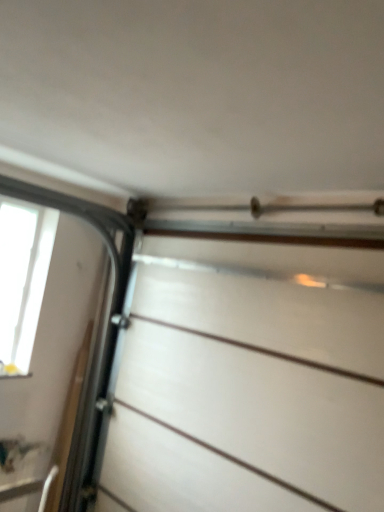
Question: Is white matte drawer at center outside transparent glass window at left?

Choices:
 (A) no
 (B) yes

Answer: (B)

Question: Does white matte drawer at center have a greater height compared to transparent glass window at left?

Choices:
 (A) yes
 (B) no

Answer: (A)

Question: Is white matte drawer at center placed right next to transparent glass window at left?

Choices:
 (A) yes
 (B) no

Answer: (B)

Question: Is white matte drawer at center positioned in front of transparent glass window at left?

Choices:
 (A) no
 (B) yes

Answer: (B)

Question: Does white matte drawer at center have a lesser width compared to transparent glass window at left?

Choices:
 (A) yes
 (B) no

Answer: (B)

Question: From the image's perspective, is white matte drawer at center under transparent glass window at left?

Choices:
 (A) yes
 (B) no

Answer: (A)

Question: From the image's perspective, does transparent glass window at left appear lower than white matte drawer at center?

Choices:
 (A) no
 (B) yes

Answer: (A)

Question: Considering the relative sizes of transparent glass window at left and white matte drawer at center in the image provided, is transparent glass window at left wider than white matte drawer at center?

Choices:
 (A) yes
 (B) no

Answer: (B)

Question: Considering the relative positions of transparent glass window at left and white matte drawer at center in the image provided, is transparent glass window at left to the right of white matte drawer at center from the viewer's perspective?

Choices:
 (A) no
 (B) yes

Answer: (A)

Question: Is transparent glass window at left positioned beyond the bounds of white matte drawer at center?

Choices:
 (A) yes
 (B) no

Answer: (A)

Question: Can you see transparent glass window at left touching white matte drawer at center?

Choices:
 (A) yes
 (B) no

Answer: (B)

Question: Is transparent glass window at left positioned in front of white matte drawer at center?

Choices:
 (A) no
 (B) yes

Answer: (A)

Question: In the image, is transparent glass window at left positioned in front of or behind white matte drawer at center?

Choices:
 (A) behind
 (B) front

Answer: (A)